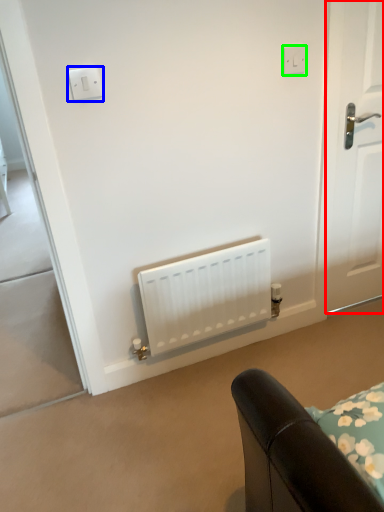
Question: Estimate the real-world distances between objects in this image. Which object is farther from door (highlighted by a red box), light switch (highlighted by a blue box) or electric outlet (highlighted by a green box)?

Choices:
 (A) light switch
 (B) electric outlet

Answer: (A)